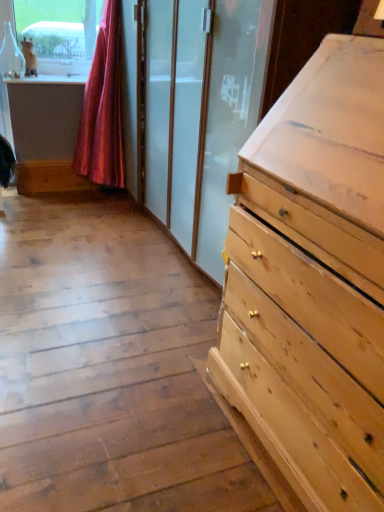
The width and height of the screenshot is (384, 512). Identify the location of free space in front of white fur cat at upper left. tap(29, 80).